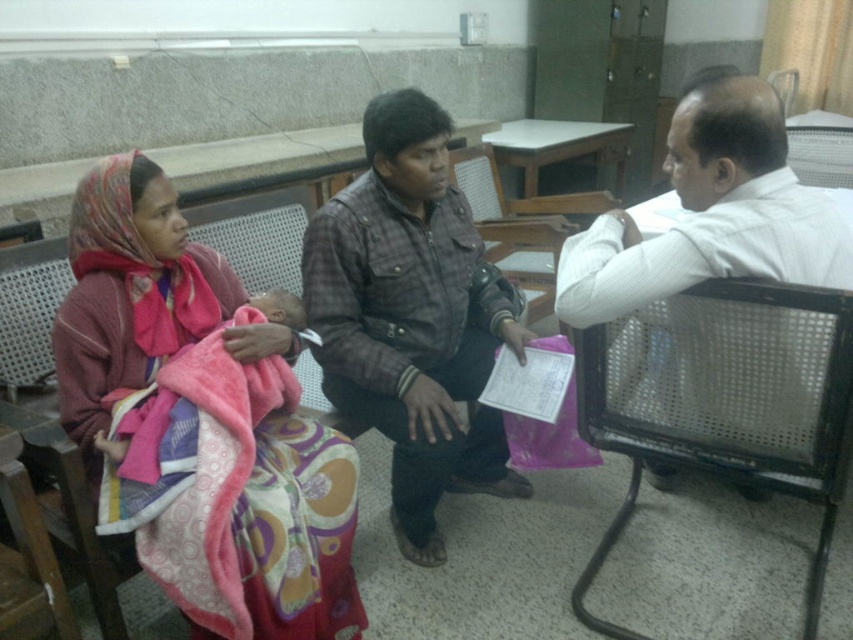
In the waiting area scene, there are two blankets visible. The first is a matte pink blanket at left, and the second is a pink soft blanket at center. Which blanket is positioned lower in the image?

The matte pink blanket at left is positioned lower in the image as it is below the pink soft blanket at center.

You are a photographer setting up a tripod at point 0.5, 0.5. You want to capture the matte pink blanket at left in your shot. Is the blanket within the camera frame if the camera has a 60 degree field of view?

The matte pink blanket at left is located at point (201, 420). The distance from the camera at (426, 320) to the blanket is sqrt of 0.059 squared plus 0.263 squared which is approximately 0.271 units. With a 60 degree field of view, the maximum distance for the blanket to be in frame is tan 30 degrees times the distance from the camera. Wait, perhaps better to use the field of view formula. The horizontal and vertical angles would determine the coverage. Alternatively, assuming the camera is at the center, a

You are a photographer trying to capture the scene from the front. Which blanket, the matte pink blanket at left or the pink soft blanket at center, would appear larger in your photo?

The matte pink blanket at left appears larger in the photo because it is closer to the viewer than the pink soft blanket at center.